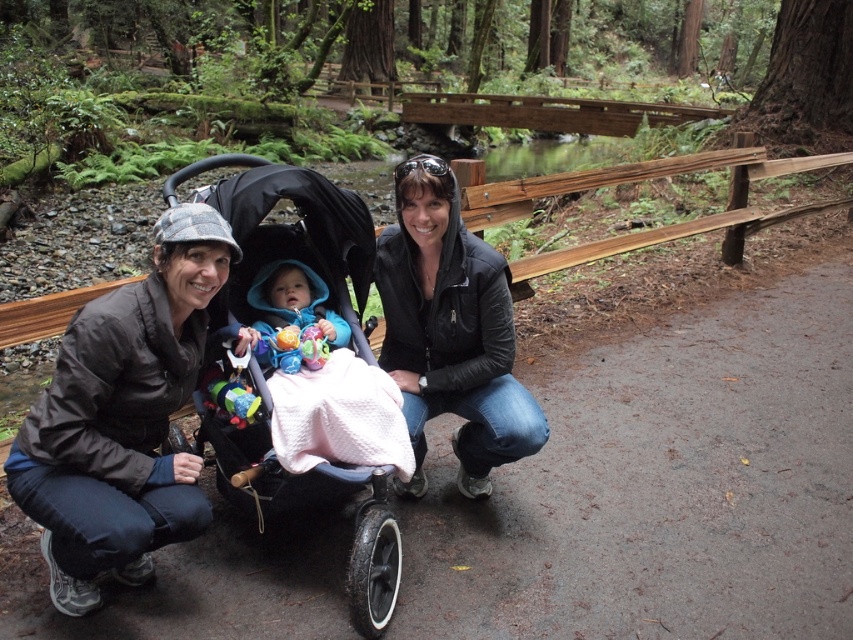
You are a photographer standing at the edge of the path. You want to take a photo of the blue fabric baby at center without the brown matte jacket at lower left blocking it. Can you move to the side to achieve this?

The brown matte jacket at lower left is in front of the blue fabric baby at center, so moving to the side might allow you to position yourself where the jacket no longer blocks the baby.

You are a photographer trying to capture a photo of the two subjects in the scene. Given that your camera frame can only accommodate objects up to the width of the black leather jacket at center, will the blue fabric baby at center fit within the same frame?

The black leather jacket at center is wider than the blue fabric baby at center, so the blue fabric baby at center will fit within the camera frame designed for the black leather jacket at center.